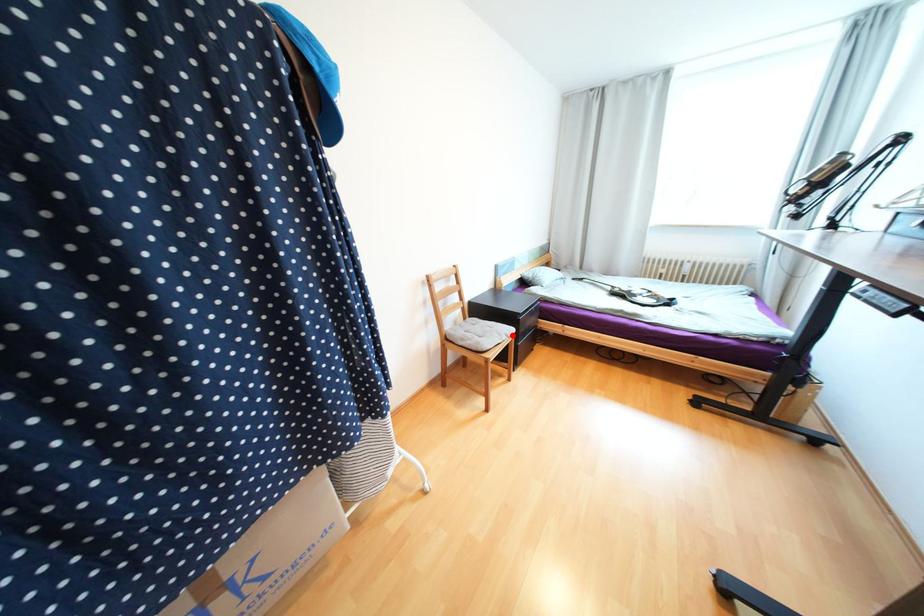
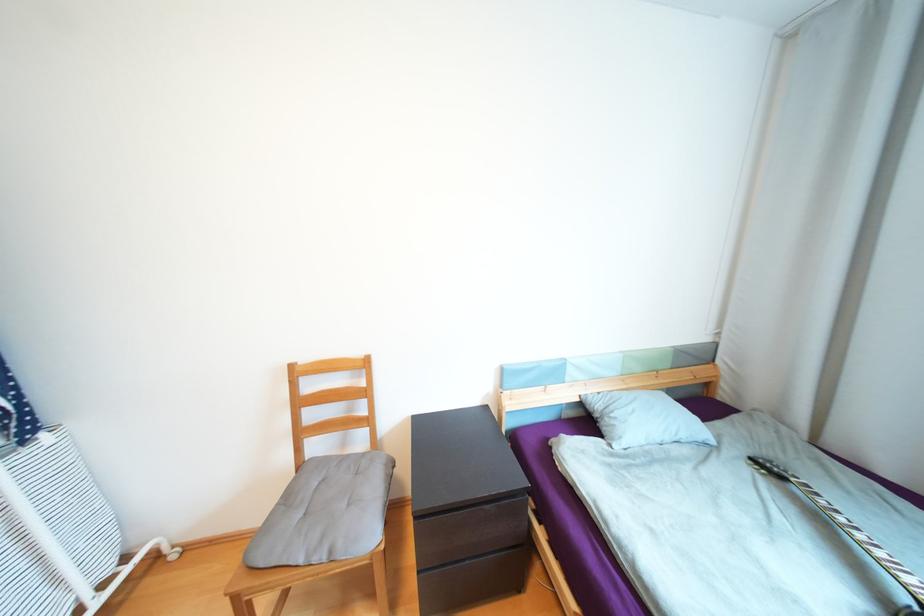
Question: I am providing you with two images of the same scene from different viewpoints. A red point is marked on the first image. At the location where the point appears in image 1, is it still visible in image 2?

Choices:
 (A) Yes
 (B) No

Answer: (A)